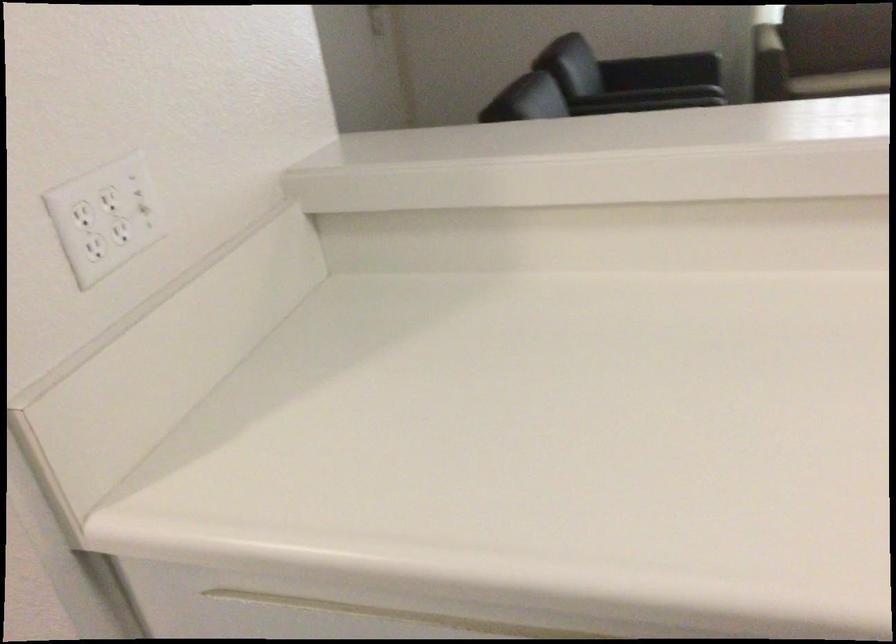
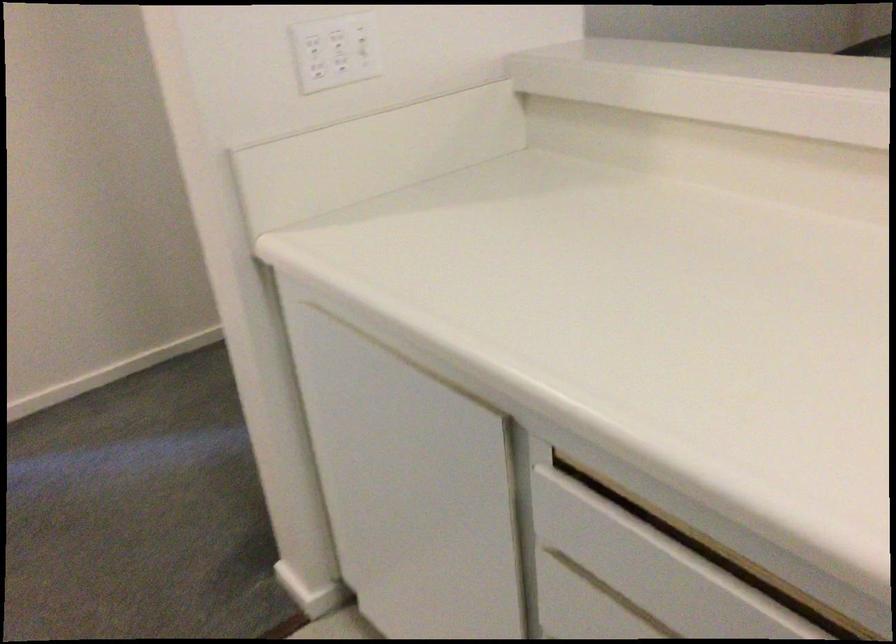
Where in the second image is the point corresponding to [75,207] from the first image?

(309, 39)